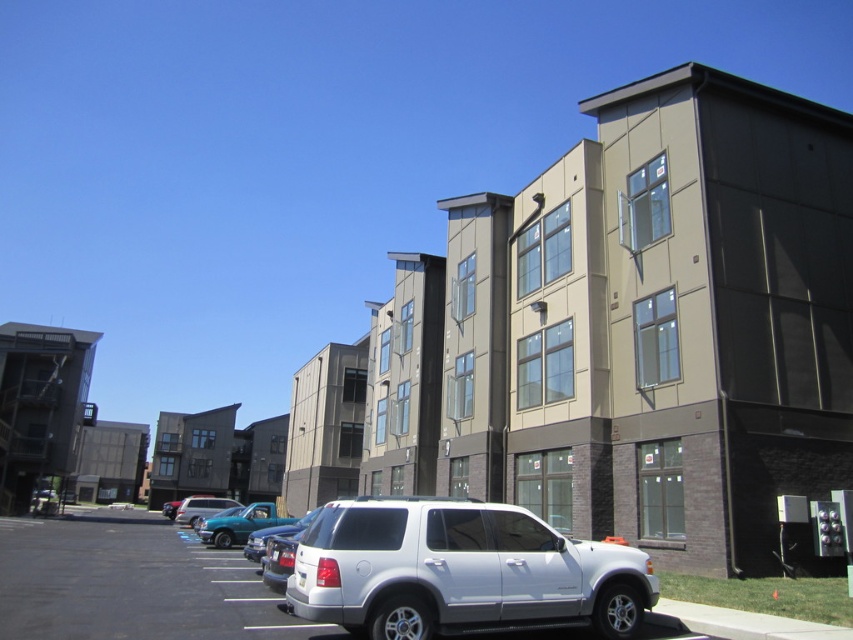
In the scene shown: Who is higher up, white matte suv at center or teal glossy truck at lower left?

Positioned higher is white matte suv at center.

Who is lower down, white matte suv at center or teal glossy truck at lower left?

teal glossy truck at lower left

Who is more forward, (381,524) or (199,529)?

Positioned in front is point (381,524).

Where is `white matte suv at center`? The height and width of the screenshot is (640, 853). white matte suv at center is located at coordinates (460, 572).

Who is positioned more to the left, white matte suv at center or matte silver suv at center?

matte silver suv at center is more to the left.

Does point (355, 534) lie behind point (195, 509)?

No, (355, 534) is in front of (195, 509).

Identify the location of white matte suv at center. The height and width of the screenshot is (640, 853). (460, 572).

The height and width of the screenshot is (640, 853). Find the location of `white matte suv at center`. white matte suv at center is located at coordinates (460, 572).

Who is taller, teal glossy truck at lower left or matte silver suv at center?

teal glossy truck at lower left is taller.

Locate an element on the screen. teal glossy truck at lower left is located at coordinates (239, 524).

The width and height of the screenshot is (853, 640). I want to click on teal glossy truck at lower left, so click(x=239, y=524).